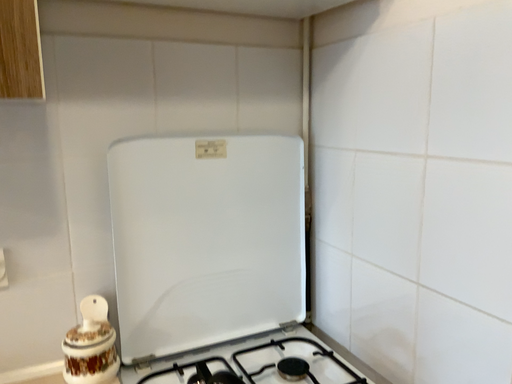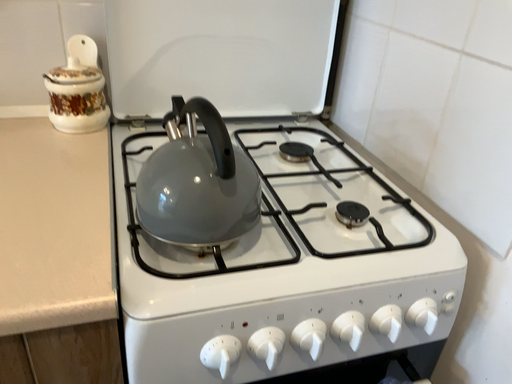
Question: Which way did the camera rotate in the video?

Choices:
 (A) rotated downward
 (B) rotated upward

Answer: (A)